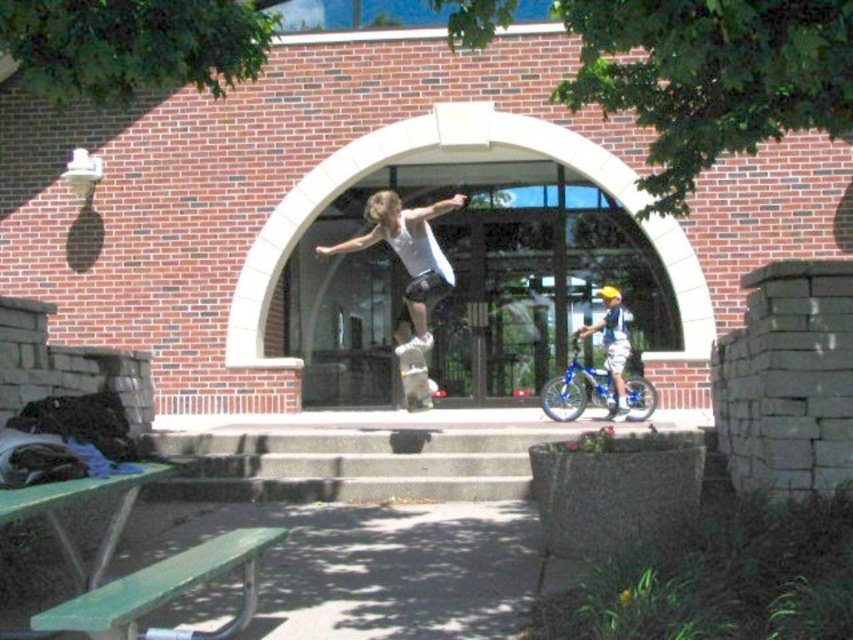
You are standing at the point labeled point(408, 282) and want to walk to the point labeled point(430, 342). Which direction should you face to move toward your destination?

You should face forward because point(408, 282) is behind point(430, 342), so moving forward from point(408, 282) will take you toward point(430, 342).

From the picture: You are standing at the point labeled point (86, 600) and want to walk towards the point labeled point (412, 211). According to the scene, will you be moving towards the building or away from it?

Since point (86, 600) is in front of point (412, 211), moving from point (86, 600) towards point (412, 211) means you are moving away from the building.

You are standing in front of the brick building and want to place a small flag exactly at the position of point (558,381) and point (409,401). Which point is closer to you so you can place the flag without needing to move further back?

Point (558,381) is further to the viewer than point (409,401), so the point (558,381) is closer to you and you can place the flag there without moving back.